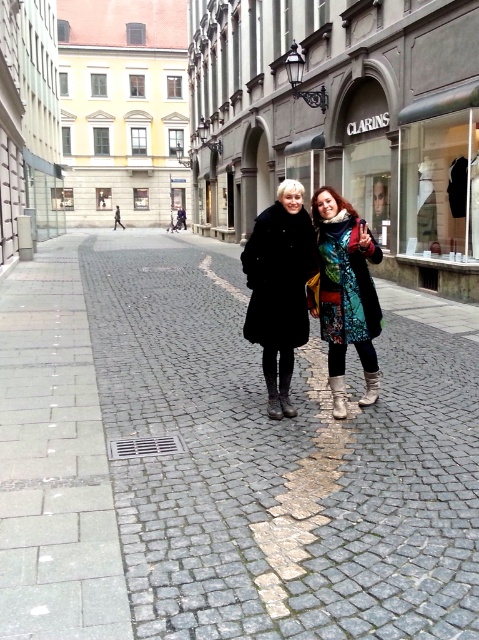
You are a photographer trying to capture a photo of the two coats in the scene. Since you want to focus on the multicolored patchwork coat at center, where should you position the matte black coat at center relative to it?

The matte black coat at center is to the left of multicolored patchwork coat at center, so to focus on the multicolored patchwork coat at center, position the matte black coat at center to its left side.

You are a photographer trying to capture both the matte black coat at center and the multicolored patchwork coat at center in a single frame. Which coat should you focus on first to ensure both are in the shot, considering their heights?

The matte black coat at center is taller than the multicolored patchwork coat at center. To ensure both are in the shot, focus on the taller matte black coat at center first, then adjust the framing to include the shorter multicolored patchwork coat at center.

In the scene shown: You are standing on the cobblestone street in the image. There is a point marked at coordinates [225,460]. What is located at that point?

The point at coordinates [225,460] corresponds to the gray cobblestone pavement at center.